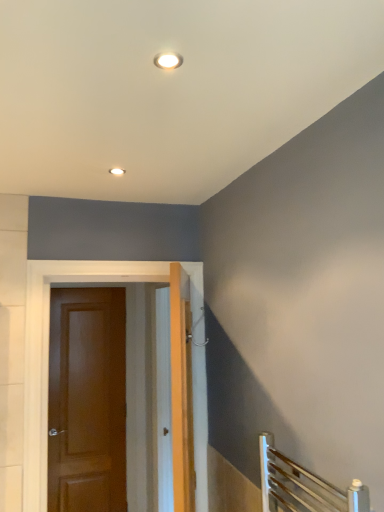
Question: From a real-world perspective, is matte white recessed light at upper center beneath brown wooden door at center, which appears as the first door when viewed from the front?

Choices:
 (A) no
 (B) yes

Answer: (A)

Question: Is matte white recessed light at upper center aimed at brown wooden door at center, the 1th door from the right?

Choices:
 (A) yes
 (B) no

Answer: (B)

Question: Can you confirm if matte white recessed light at upper center is bigger than brown wooden door at center, arranged as the second door when viewed from the left?

Choices:
 (A) yes
 (B) no

Answer: (B)

Question: Does matte white recessed light at upper center have a greater width compared to brown wooden door at center, which appears as the first door when viewed from the front?

Choices:
 (A) yes
 (B) no

Answer: (B)

Question: Does matte white recessed light at upper center have a lesser width compared to brown wooden door at center, the 1th door from the right?

Choices:
 (A) no
 (B) yes

Answer: (B)

Question: Considering the relative positions of matte white recessed light at upper center and brown wooden door at center, arranged as the second door when viewed from the left, in the image provided, is matte white recessed light at upper center to the right of brown wooden door at center, arranged as the second door when viewed from the left, from the viewer's perspective?

Choices:
 (A) no
 (B) yes

Answer: (B)

Question: Does matte brown door at left, the second door viewed from the front, have a greater width compared to brown wooden door at center, the 2th door viewed from the back?

Choices:
 (A) no
 (B) yes

Answer: (A)

Question: Is matte brown door at left, positioned as the second door in right-to-left order, turned away from brown wooden door at center, which appears as the first door when viewed from the front?

Choices:
 (A) yes
 (B) no

Answer: (B)

Question: From a real-world perspective, is matte brown door at left, positioned as the first door in back-to-front order, positioned under brown wooden door at center, the 2th door viewed from the back, based on gravity?

Choices:
 (A) yes
 (B) no

Answer: (A)

Question: Can you confirm if matte brown door at left, positioned as the second door in right-to-left order, is smaller than brown wooden door at center, which appears as the first door when viewed from the front?

Choices:
 (A) yes
 (B) no

Answer: (A)

Question: Is there a large distance between matte brown door at left, positioned as the second door in right-to-left order, and brown wooden door at center, the 1th door from the right?

Choices:
 (A) no
 (B) yes

Answer: (B)

Question: Is matte brown door at left, positioned as the first door in back-to-front order, taller than brown wooden door at center, the 1th door from the right?

Choices:
 (A) no
 (B) yes

Answer: (B)

Question: Is matte white recessed light at upper center bigger than matte brown door at left, positioned as the second door in right-to-left order?

Choices:
 (A) yes
 (B) no

Answer: (B)